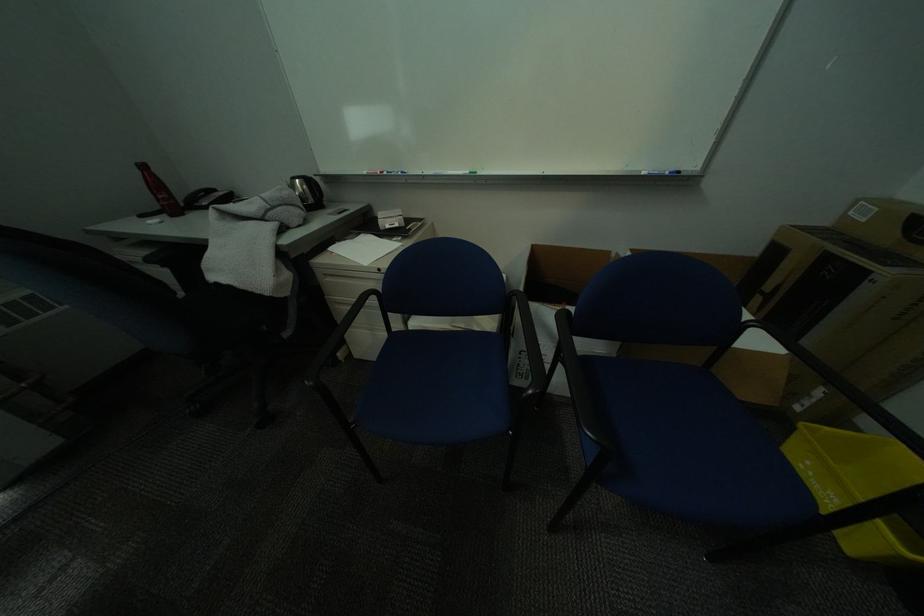
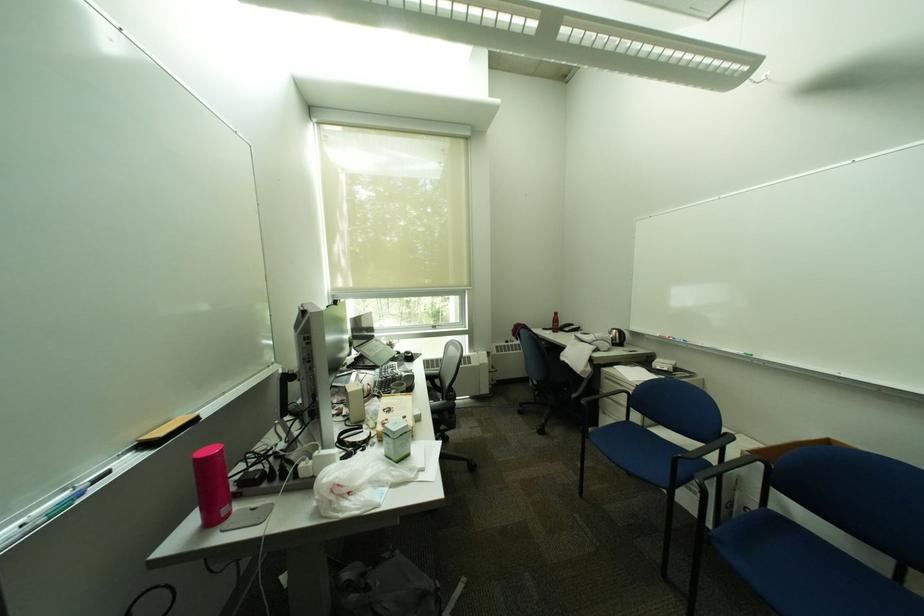
Where in the second image is the point corresponding to (x=290, y=209) from the first image?

(611, 342)